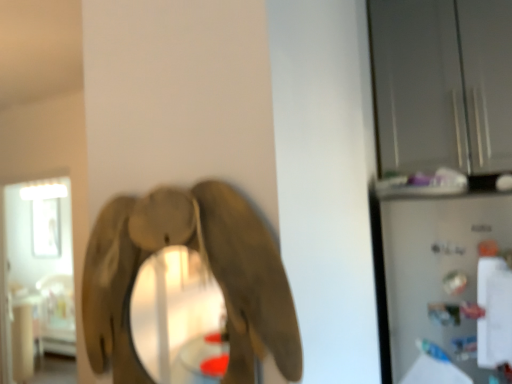
Question: From the image's perspective, is wooden elephant at center above or below transparent glass door at left, which is counted as the 1th glass door, starting from the left?

Choices:
 (A) below
 (B) above

Answer: (B)

Question: Is wooden elephant at center spatially inside transparent glass door at left, which is counted as the 1th glass door, starting from the left, or outside of it?

Choices:
 (A) inside
 (B) outside

Answer: (B)

Question: Which of these objects is positioned closest to the satin silver refrigerator at right?

Choices:
 (A) transparent glass cabinet at upper right, marked as the 2th glass door in a bottom-to-top arrangement
 (B) wooden elephant at center
 (C) transparent glass door at left, which is counted as the 1th glass door, starting from the left

Answer: (A)

Question: Considering the real-world distances, which object is farthest from the satin silver refrigerator at right?

Choices:
 (A) transparent glass door at left, the first glass door positioned from the bottom
 (B) transparent glass cabinet at upper right, which is the first glass door from front to back
 (C) wooden elephant at center

Answer: (A)